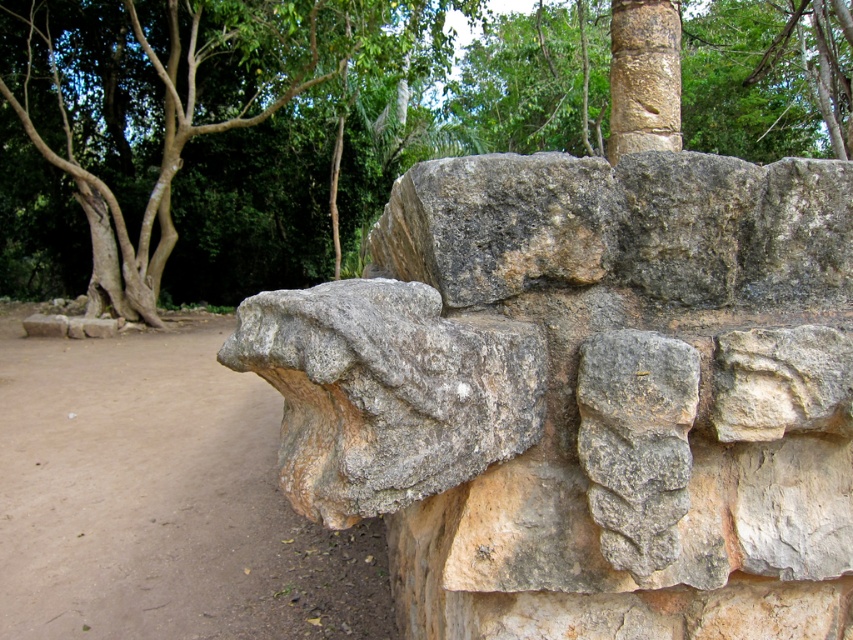
Consider the image. Does gray stone wall at center appear on the right side of brown dirt field at lower left?

Indeed, gray stone wall at center is positioned on the right side of brown dirt field at lower left.

Does gray stone wall at center have a greater height compared to brown dirt field at lower left?

Yes.

The image size is (853, 640). What do you see at coordinates (585, 396) in the screenshot?
I see `gray stone wall at center` at bounding box center [585, 396].

Identify the location of gray stone wall at center. (585, 396).

Looking at this image, is brown dirt field at lower left in front of smooth brown stone column at upper center?

No, brown dirt field at lower left is behind smooth brown stone column at upper center.

Who is shorter, brown dirt field at lower left or smooth brown stone column at upper center?

Standing shorter between the two is brown dirt field at lower left.

Find the location of a particular element. The image size is (853, 640). brown dirt field at lower left is located at coordinates (161, 499).

What are the coordinates of `brown dirt field at lower left` in the screenshot? It's located at (161, 499).

Can you confirm if green leafy tree at upper center is positioned to the left of gray rough stone at center?

Indeed, green leafy tree at upper center is positioned on the left side of gray rough stone at center.

Is point (508, 83) positioned before point (358, 369)?

No, it is behind (358, 369).

The height and width of the screenshot is (640, 853). Find the location of `green leafy tree at upper center`. green leafy tree at upper center is located at coordinates (254, 132).